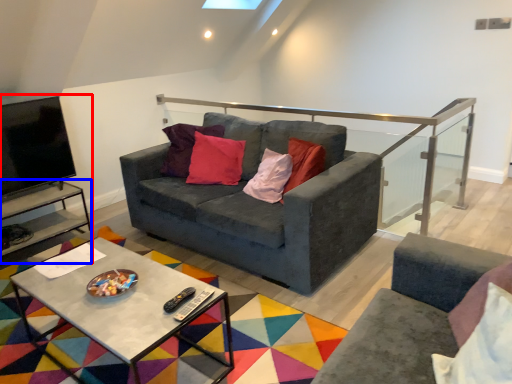
Question: Which object is closer to the camera taking this photo, entertainment center (highlighted by a red box) or side table (highlighted by a blue box)?

Choices:
 (A) entertainment center
 (B) side table

Answer: (A)